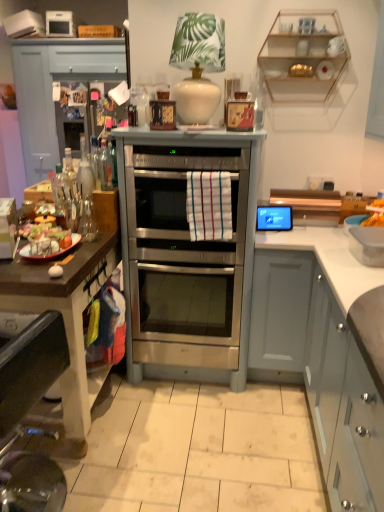
Locate an element on the screen. vacant area that lies in front of matte black tablet at upper right is located at coordinates (283, 240).